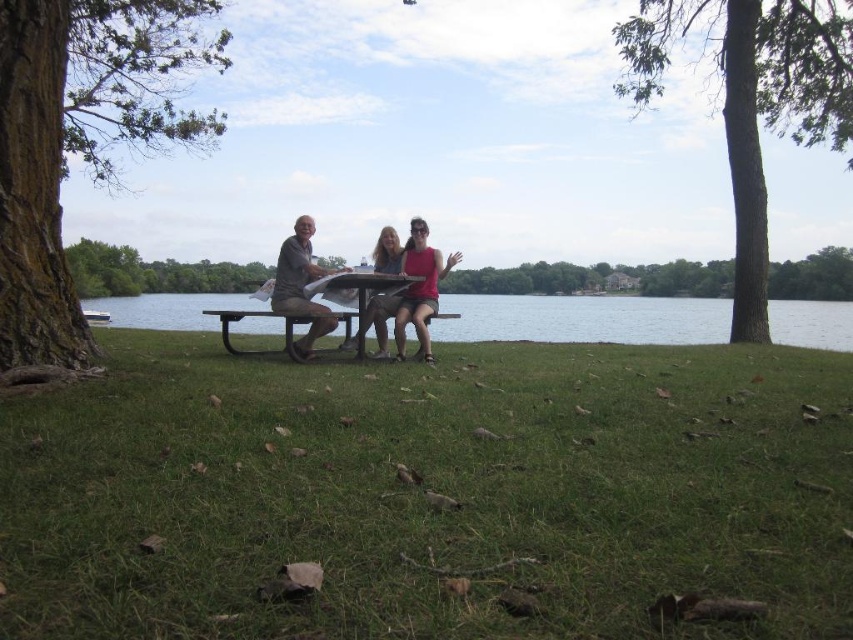
Question: Considering the real-world distances, which object is farthest from the matte brown shirt at center?

Choices:
 (A) green rough bark tree at upper right
 (B) matte gray shorts at center
 (C) matte pink tank top at center

Answer: (A)

Question: Can you confirm if matte brown shirt at center is smaller than metallic silver picnic table at center?

Choices:
 (A) no
 (B) yes

Answer: (A)

Question: Does clear water at center have a larger size compared to metallic silver picnic table at center?

Choices:
 (A) yes
 (B) no

Answer: (A)

Question: Is brown rough bark tree at left wider than green rough bark tree at upper right?

Choices:
 (A) yes
 (B) no

Answer: (B)

Question: Which object is closer to the camera taking this photo?

Choices:
 (A) green rough bark tree at upper right
 (B) metallic silver picnic table at center
 (C) metallic picnic table at center
 (D) matte gray shorts at center

Answer: (B)

Question: Which of the following is the farthest from the observer?

Choices:
 (A) (526, 332)
 (B) (350, 284)

Answer: (A)